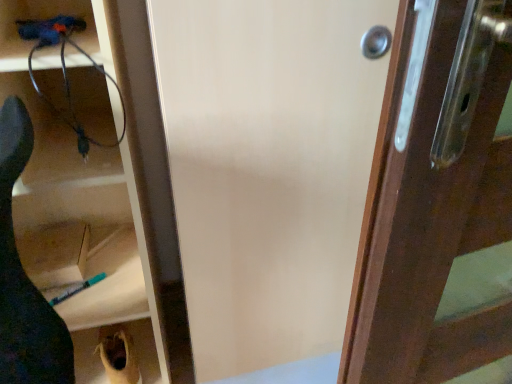
How much space does brown fabric bag at lower left, marked as the 1th cabinetry in a bottom-to-top arrangement, occupy horizontally?

It is 11.33 inches.

Measure the distance between brown fabric bag at lower left, marked as the 1th cabinetry in a bottom-to-top arrangement, and camera.

A distance of 4.00 feet exists between brown fabric bag at lower left, marked as the 1th cabinetry in a bottom-to-top arrangement, and camera.

At what (x,y) coordinates should I click in order to perform the action: click on black matte shoe at lower left. Please return your answer as a coordinate pair (x, y). Looking at the image, I should click on (25, 277).

What is the approximate height of black matte shoe at lower left?

black matte shoe at lower left is 33.99 inches tall.

Image resolution: width=512 pixels, height=384 pixels. I want to click on matte wood screen door at center, so click(x=268, y=168).

From the picture: In order to face dark brown wood at right, should I rotate leftwards or rightwards?

A 29.337 degree turn to the right will do.

At what (x,y) coordinates should I click in order to perform the action: click on brown fabric bag at lower left, marked as the 1th cabinetry in a bottom-to-top arrangement. Please return your answer as a coordinate pair (x, y). Looking at the image, I should click on (88, 357).

Is black matte shoe at lower left completely or partially outside of dark brown wood at right?

Indeed, black matte shoe at lower left is completely outside dark brown wood at right.

Locate an element on the screen. Image resolution: width=512 pixels, height=384 pixels. animal in front of the dark brown wood at right is located at coordinates (25, 277).

What's the angular difference between black matte shoe at lower left and dark brown wood at right's facing directions?

The angle between the facing direction of black matte shoe at lower left and the facing direction of dark brown wood at right is 2.72 degrees.

Is black matte shoe at lower left thinner than dark brown wood at right?

Yes, black matte shoe at lower left is thinner than dark brown wood at right.

From a real-world perspective, is black matte shoe at lower left below matte wood screen door at center?

Yes.

Does black matte shoe at lower left have a larger size compared to matte wood screen door at center?

Actually, black matte shoe at lower left might be smaller than matte wood screen door at center.

Does black matte shoe at lower left touch matte wood screen door at center?

black matte shoe at lower left is not next to matte wood screen door at center, and they're not touching.

Considering the points (161, 268) and (20, 129), which point is in front, point (161, 268) or point (20, 129)?

The point (20, 129) is closer to the camera.

Is matte plastic cabinet at left, acting as the second cabinetry starting from the bottom, at the left side of black matte shoe at lower left?

Correct, you'll find matte plastic cabinet at left, acting as the second cabinetry starting from the bottom, to the left of black matte shoe at lower left.

Can you see brown fabric bag at lower left, marked as the 1th cabinetry in a bottom-to-top arrangement, touching matte plastic cabinet at left, acting as the second cabinetry starting from the bottom?

brown fabric bag at lower left, marked as the 1th cabinetry in a bottom-to-top arrangement, is not next to matte plastic cabinet at left, acting as the second cabinetry starting from the bottom, and they're not touching.

Which object is more forward, brown fabric bag at lower left, marked as the 1th cabinetry in a bottom-to-top arrangement, or matte plastic cabinet at left, marked as the 1th cabinetry in a top-to-bottom arrangement?

matte plastic cabinet at left, marked as the 1th cabinetry in a top-to-bottom arrangement.

From a real-world perspective, is brown fabric bag at lower left, which is the second cabinetry in top-to-bottom order, located higher than matte plastic cabinet at left, marked as the 1th cabinetry in a top-to-bottom arrangement?

No, from a real-world perspective, brown fabric bag at lower left, which is the second cabinetry in top-to-bottom order, is not on top of matte plastic cabinet at left, marked as the 1th cabinetry in a top-to-bottom arrangement.

The width and height of the screenshot is (512, 384). I want to click on cabinetry that is on the right side of matte plastic cabinet at left, marked as the 1th cabinetry in a top-to-bottom arrangement, so click(88, 357).

Considering the sizes of objects dark brown wood at right and brown fabric bag at lower left, which is the second cabinetry in top-to-bottom order, in the image provided, who is bigger, dark brown wood at right or brown fabric bag at lower left, which is the second cabinetry in top-to-bottom order,?

With larger size is dark brown wood at right.

How many degrees apart are the facing directions of dark brown wood at right and brown fabric bag at lower left, marked as the 1th cabinetry in a bottom-to-top arrangement?

dark brown wood at right and brown fabric bag at lower left, marked as the 1th cabinetry in a bottom-to-top arrangement, are facing 97.6 degrees away from each other.

Is dark brown wood at right thinner than brown fabric bag at lower left, which is the second cabinetry in top-to-bottom order?

No, dark brown wood at right is not thinner than brown fabric bag at lower left, which is the second cabinetry in top-to-bottom order.

How far apart are dark brown wood at right and brown fabric bag at lower left, marked as the 1th cabinetry in a bottom-to-top arrangement?

The distance of dark brown wood at right from brown fabric bag at lower left, marked as the 1th cabinetry in a bottom-to-top arrangement, is 36.14 inches.

Considering the relative positions of matte plastic cabinet at left, acting as the second cabinetry starting from the bottom, and dark brown wood at right in the image provided, is matte plastic cabinet at left, acting as the second cabinetry starting from the bottom, to the left or to the right of dark brown wood at right?

In the image, matte plastic cabinet at left, acting as the second cabinetry starting from the bottom, appears on the left side of dark brown wood at right.

Is matte plastic cabinet at left, marked as the 1th cabinetry in a top-to-bottom arrangement, placed right next to dark brown wood at right?

There is a gap between matte plastic cabinet at left, marked as the 1th cabinetry in a top-to-bottom arrangement, and dark brown wood at right.

In terms of width, does matte plastic cabinet at left, acting as the second cabinetry starting from the bottom, look wider or thinner when compared to dark brown wood at right?

Answer: matte plastic cabinet at left, acting as the second cabinetry starting from the bottom, is thinner than dark brown wood at right.

Between dark brown wood at right and matte plastic cabinet at left, acting as the second cabinetry starting from the bottom, which one has smaller size?

With smaller size is dark brown wood at right.

Is dark brown wood at right positioned beyond the bounds of matte plastic cabinet at left, marked as the 1th cabinetry in a top-to-bottom arrangement?

Yes, dark brown wood at right is outside of matte plastic cabinet at left, marked as the 1th cabinetry in a top-to-bottom arrangement.

From the image's perspective, which is below, dark brown wood at right or matte plastic cabinet at left, marked as the 1th cabinetry in a top-to-bottom arrangement?

dark brown wood at right appears lower in the image.

From a real-world perspective, which cabinetry is the 1st one underneath the dark brown wood at right? Please provide its 2D coordinates.

[(133, 165)]

Find the location of a particular element. This screenshot has height=384, width=512. wood that appears behind the black matte shoe at lower left is located at coordinates (433, 196).

Identify the location of animal on the left of the matte wood screen door at center. Image resolution: width=512 pixels, height=384 pixels. (25, 277).

When comparing their distances from black matte shoe at lower left, does matte wood screen door at center or matte plastic cabinet at left, marked as the 1th cabinetry in a top-to-bottom arrangement, seem closer?

matte plastic cabinet at left, marked as the 1th cabinetry in a top-to-bottom arrangement, is positioned closer to the anchor black matte shoe at lower left.

When comparing their distances from dark brown wood at right, does brown fabric bag at lower left, marked as the 1th cabinetry in a bottom-to-top arrangement, or matte wood screen door at center seem closer?

matte wood screen door at center is positioned closer to the anchor dark brown wood at right.

Considering their positions, is matte plastic cabinet at left, marked as the 1th cabinetry in a top-to-bottom arrangement, positioned closer to matte wood screen door at center than brown fabric bag at lower left, which is the second cabinetry in top-to-bottom order?

Among the two, matte plastic cabinet at left, marked as the 1th cabinetry in a top-to-bottom arrangement, is located nearer to matte wood screen door at center.

Considering their positions, is dark brown wood at right positioned closer to black matte shoe at lower left than brown fabric bag at lower left, which is the second cabinetry in top-to-bottom order?

brown fabric bag at lower left, which is the second cabinetry in top-to-bottom order, lies closer to black matte shoe at lower left than the other object.

Which object lies nearer to the anchor point matte plastic cabinet at left, acting as the second cabinetry starting from the bottom, brown fabric bag at lower left, which is the second cabinetry in top-to-bottom order, or black matte shoe at lower left?

The object closer to matte plastic cabinet at left, acting as the second cabinetry starting from the bottom, is black matte shoe at lower left.

From the image, which object appears to be farther from matte plastic cabinet at left, marked as the 1th cabinetry in a top-to-bottom arrangement, dark brown wood at right or brown fabric bag at lower left, marked as the 1th cabinetry in a bottom-to-top arrangement?

dark brown wood at right.

Estimate the real-world distances between objects in this image. Which object is further from matte plastic cabinet at left, marked as the 1th cabinetry in a top-to-bottom arrangement, dark brown wood at right or matte wood screen door at center?

Among the two, dark brown wood at right is located further to matte plastic cabinet at left, marked as the 1th cabinetry in a top-to-bottom arrangement.

Which object lies further to the anchor point brown fabric bag at lower left, marked as the 1th cabinetry in a bottom-to-top arrangement, dark brown wood at right or black matte shoe at lower left?

dark brown wood at right lies further to brown fabric bag at lower left, marked as the 1th cabinetry in a bottom-to-top arrangement, than the other object.

Image resolution: width=512 pixels, height=384 pixels. Identify the location of screen door between brown fabric bag at lower left, marked as the 1th cabinetry in a bottom-to-top arrangement, and dark brown wood at right, in the horizontal direction. (268, 168).

The image size is (512, 384). Identify the location of cabinetry between black matte shoe at lower left and brown fabric bag at lower left, which is the second cabinetry in top-to-bottom order, in the front-back direction. (133, 165).

I want to click on animal between matte plastic cabinet at left, marked as the 1th cabinetry in a top-to-bottom arrangement, and matte wood screen door at center, in the horizontal direction, so click(x=25, y=277).

What are the coordinates of `wood between black matte shoe at lower left and brown fabric bag at lower left, which is the second cabinetry in top-to-bottom order, in the front-back direction` in the screenshot? It's located at (433, 196).